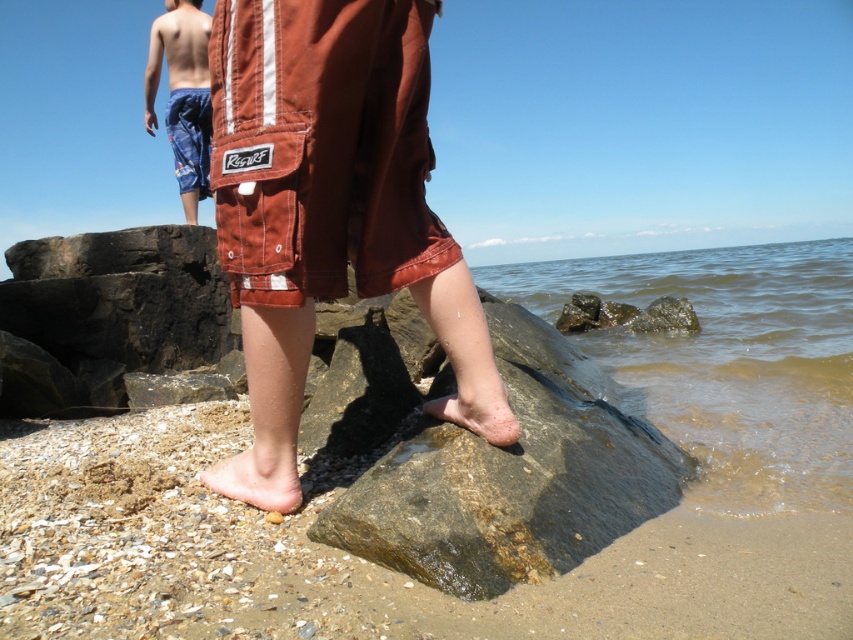
Does point (177, 52) come closer to viewer compared to point (469, 314)?

That is False.

Can you confirm if blue printed shorts at upper left is positioned above dry skin foot at lower center?

Indeed, blue printed shorts at upper left is positioned over dry skin foot at lower center.

Between point (202, 88) and point (439, 397), which one is positioned in front?

Point (439, 397) is more forward.

You are a GUI agent. You are given a task and a screenshot of the screen. Output one action in this format:
    pyautogui.click(x=<x>, y=<y>)
    Task: Click on the blue printed shorts at upper left
    The width and height of the screenshot is (853, 640).
    Given the screenshot: What is the action you would take?
    pyautogui.click(x=183, y=96)

Is brown sandy beach at lower left positioned at the back of dry skin foot at lower center?

No, brown sandy beach at lower left is closer to the viewer.

Measure the distance from brown sandy beach at lower left to dry skin foot at lower center.

brown sandy beach at lower left is 21.12 inches away from dry skin foot at lower center.

Does point (141, 483) come behind point (492, 385)?

Yes.

Image resolution: width=853 pixels, height=640 pixels. Find the location of `brown sandy beach at lower left`. brown sandy beach at lower left is located at coordinates (352, 556).

Where is `dry skin foot at lower center`? Image resolution: width=853 pixels, height=640 pixels. dry skin foot at lower center is located at coordinates (479, 408).

Between dry skin foot at lower center and smooth skin torso at upper left, which one appears on the left side from the viewer's perspective?

Positioned to the left is smooth skin torso at upper left.

Where is `dry skin foot at lower center`? This screenshot has width=853, height=640. dry skin foot at lower center is located at coordinates (479, 408).

Where is `dry skin foot at lower center`? Image resolution: width=853 pixels, height=640 pixels. dry skin foot at lower center is located at coordinates (479, 408).